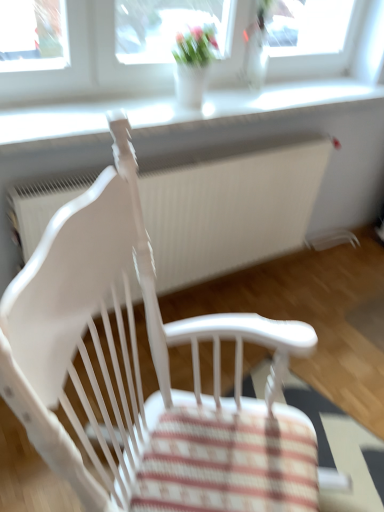
Question: Is white wood chair at center a part of white plastic window sill at upper center?

Choices:
 (A) no
 (B) yes

Answer: (A)

Question: From a real-world perspective, is white plastic window sill at upper center physically below white wood chair at center?

Choices:
 (A) no
 (B) yes

Answer: (A)

Question: Could you tell me if white plastic window sill at upper center is turned towards white wood chair at center?

Choices:
 (A) yes
 (B) no

Answer: (B)

Question: Is white plastic window sill at upper center far from white wood chair at center?

Choices:
 (A) yes
 (B) no

Answer: (B)

Question: Is white plastic window sill at upper center bigger than white wood chair at center?

Choices:
 (A) no
 (B) yes

Answer: (A)

Question: Is point (198, 182) positioned closer to the camera than point (162, 106)?

Choices:
 (A) farther
 (B) closer

Answer: (A)

Question: Is white textured radiator at center inside the boundaries of white plastic window sill at upper center, or outside?

Choices:
 (A) inside
 (B) outside

Answer: (B)

Question: Is white textured radiator at center bigger or smaller than white plastic window sill at upper center?

Choices:
 (A) big
 (B) small

Answer: (A)

Question: From the image's perspective, is white textured radiator at center positioned above or below white plastic window sill at upper center?

Choices:
 (A) above
 (B) below

Answer: (B)

Question: Considering the positions of point (19, 320) and point (307, 159), is point (19, 320) closer or farther from the camera than point (307, 159)?

Choices:
 (A) farther
 (B) closer

Answer: (B)

Question: Relative to white textured radiator at center, is white wood chair at center in front or behind?

Choices:
 (A) front
 (B) behind

Answer: (A)

Question: In terms of size, does white wood chair at center appear bigger or smaller than white textured radiator at center?

Choices:
 (A) big
 (B) small

Answer: (A)

Question: From their relative heights in the image, would you say white wood chair at center is taller or shorter than white textured radiator at center?

Choices:
 (A) tall
 (B) short

Answer: (A)

Question: Do you think white wood chair at center is within white plastic window sill at upper center, or outside of it?

Choices:
 (A) outside
 (B) inside

Answer: (A)

Question: Is white wood chair at center wider or thinner than white plastic window sill at upper center?

Choices:
 (A) thin
 (B) wide

Answer: (B)